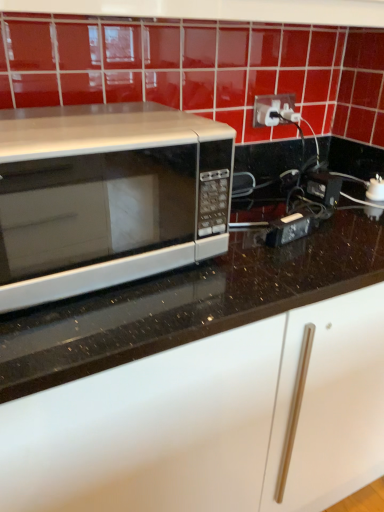
You are a GUI agent. You are given a task and a screenshot of the screen. Output one action in this format:
    pyautogui.click(x=<x>, y=<y>)
    Task: Click on the satin silver microwave at left
    The height and width of the screenshot is (512, 384).
    Given the screenshot: What is the action you would take?
    pyautogui.click(x=107, y=197)

Measure the distance between point [66,224] and camera.

Point [66,224] is 25.47 inches away from camera.

Describe the element at coordinates (107, 197) in the screenshot. I see `satin silver microwave at left` at that location.

Identify the location of white plastic outlet at upper right. (274, 110).

The height and width of the screenshot is (512, 384). Describe the element at coordinates (274, 110) in the screenshot. I see `white plastic outlet at upper right` at that location.

Measure the distance between point (256, 115) and camera.

Point (256, 115) and camera are 1.25 meters apart.

Find the location of a particular element. satin silver microwave at left is located at coordinates (107, 197).

Between white plastic outlet at upper right and satin silver microwave at left, which one appears on the right side from the viewer's perspective?

white plastic outlet at upper right.

Between white plastic outlet at upper right and satin silver microwave at left, which one is positioned in front?

Positioned in front is satin silver microwave at left.

Considering the positions of point (257, 100) and point (30, 240), is point (257, 100) closer or farther from the camera than point (30, 240)?

Clearly, point (257, 100) is more distant from the camera than point (30, 240).

From the image's perspective, who appears lower, white plastic outlet at upper right or satin silver microwave at left?

satin silver microwave at left.

From a real-world perspective, is white plastic outlet at upper right physically above satin silver microwave at left?

Yes, from a real-world perspective, white plastic outlet at upper right is over satin silver microwave at left

Considering the relative sizes of white plastic outlet at upper right and satin silver microwave at left in the image provided, is white plastic outlet at upper right thinner than satin silver microwave at left?

Indeed, white plastic outlet at upper right has a lesser width compared to satin silver microwave at left.

Does white plastic outlet at upper right have a lesser height compared to satin silver microwave at left?

Correct, white plastic outlet at upper right is not as tall as satin silver microwave at left.

Between white plastic outlet at upper right and satin silver microwave at left, which one has smaller size?

With smaller size is white plastic outlet at upper right.

Choose the correct answer: Is white plastic outlet at upper right inside satin silver microwave at left or outside it?

white plastic outlet at upper right cannot be found inside satin silver microwave at left.

Is there a large distance between white plastic outlet at upper right and satin silver microwave at left?

Actually, white plastic outlet at upper right and satin silver microwave at left are a little close together.

Is white plastic outlet at upper right facing towards satin silver microwave at left?

No.

This screenshot has height=512, width=384. In order to click on microwave oven below the white plastic outlet at upper right (from a real-world perspective) in this screenshot , I will do `click(107, 197)`.

Based on the photo, in the image, is satin silver microwave at left on the left side or the right side of white plastic outlet at upper right?

In the image, satin silver microwave at left appears on the left side of white plastic outlet at upper right.

Considering their positions, is satin silver microwave at left located in front of or behind white plastic outlet at upper right?

satin silver microwave at left is positioned closer to the viewer than white plastic outlet at upper right.

Is point (33, 205) in front of point (266, 95)?

Yes.

From the image's perspective, which one is positioned higher, satin silver microwave at left or white plastic outlet at upper right?

white plastic outlet at upper right, from the image's perspective.

From a real-world perspective, is satin silver microwave at left physically below white plastic outlet at upper right?

Yes.

Considering the relative sizes of satin silver microwave at left and white plastic outlet at upper right in the image provided, is satin silver microwave at left thinner than white plastic outlet at upper right?

Incorrect, the width of satin silver microwave at left is not less than that of white plastic outlet at upper right.

Can you confirm if satin silver microwave at left is shorter than white plastic outlet at upper right?

No.

Considering the relative sizes of satin silver microwave at left and white plastic outlet at upper right in the image provided, is satin silver microwave at left bigger than white plastic outlet at upper right?

Yes.

Which is correct: satin silver microwave at left is inside white plastic outlet at upper right, or outside of it?

satin silver microwave at left is outside white plastic outlet at upper right.

Is satin silver microwave at left in contact with white plastic outlet at upper right?

No, satin silver microwave at left is not beside white plastic outlet at upper right.

Could you tell me if satin silver microwave at left is turned towards white plastic outlet at upper right?

No.

How far apart are satin silver microwave at left and white plastic outlet at upper right?

satin silver microwave at left is 71.17 centimeters from white plastic outlet at upper right.

Find the location of a particular element. The height and width of the screenshot is (512, 384). microwave oven below the white plastic outlet at upper right (from the image's perspective) is located at coordinates (107, 197).

Locate an element on the screen. microwave oven on the left of the white plastic outlet at upper right is located at coordinates (107, 197).

Locate an element on the screen. The height and width of the screenshot is (512, 384). microwave oven in front of the white plastic outlet at upper right is located at coordinates (107, 197).